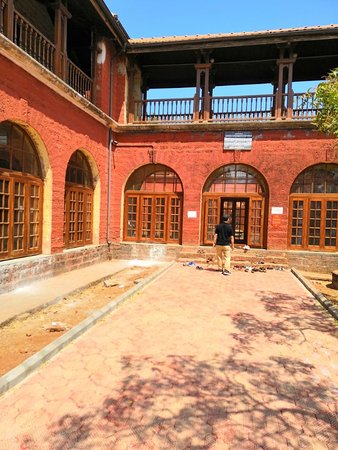
Locate an element on the screen. trash is located at coordinates (254, 272), (192, 272).